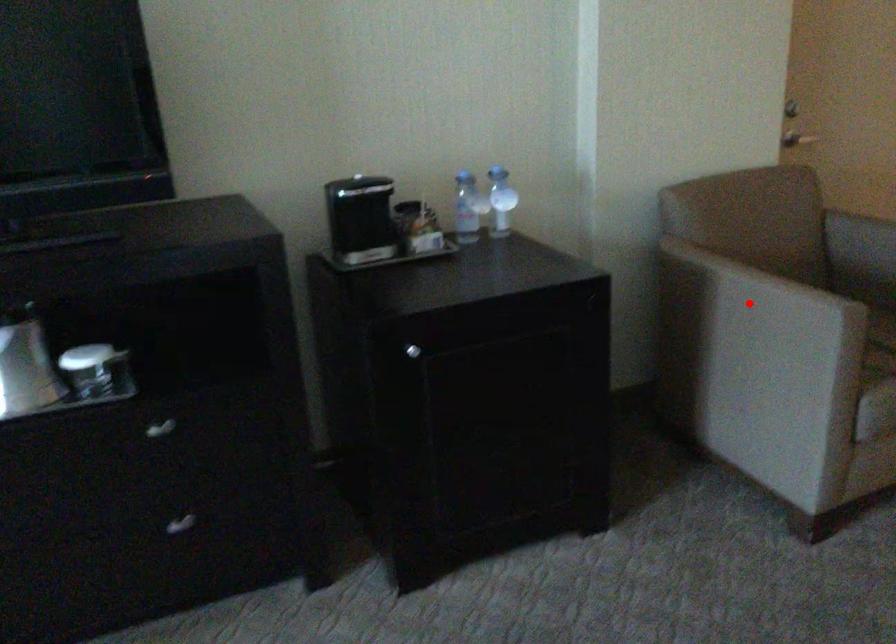
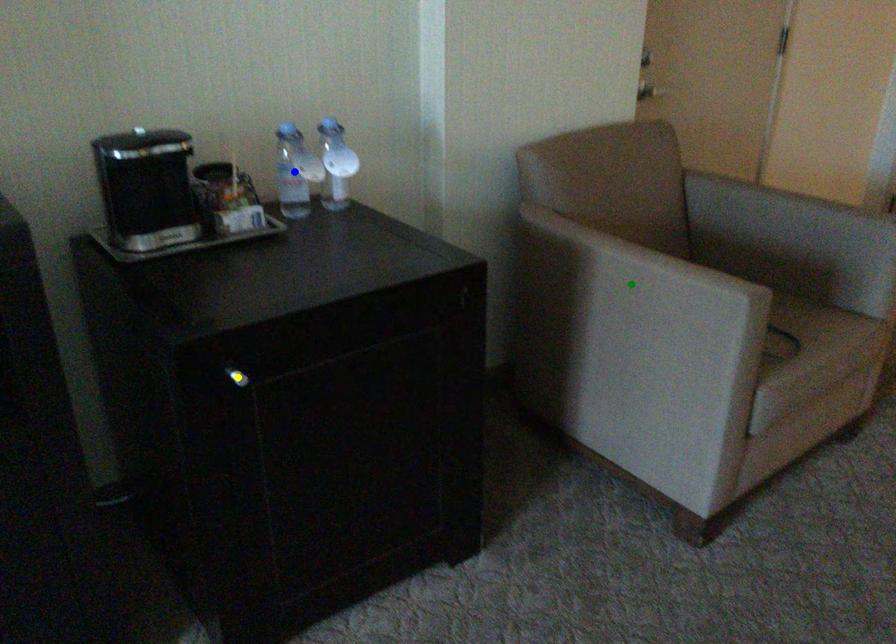
Question: I am providing you with two images of the same scene from different viewpoints. A red point is marked on the first image. You are given multiple points on the second image. Which mark in image 2 goes with the point in image 1?

Choices:
 (A) green point
 (B) yellow point
 (C) blue point

Answer: (A)